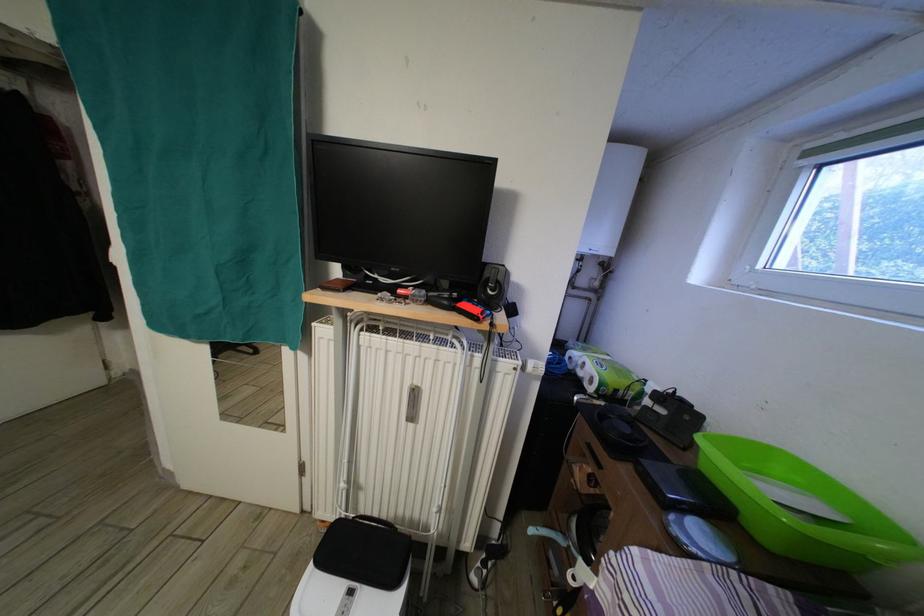
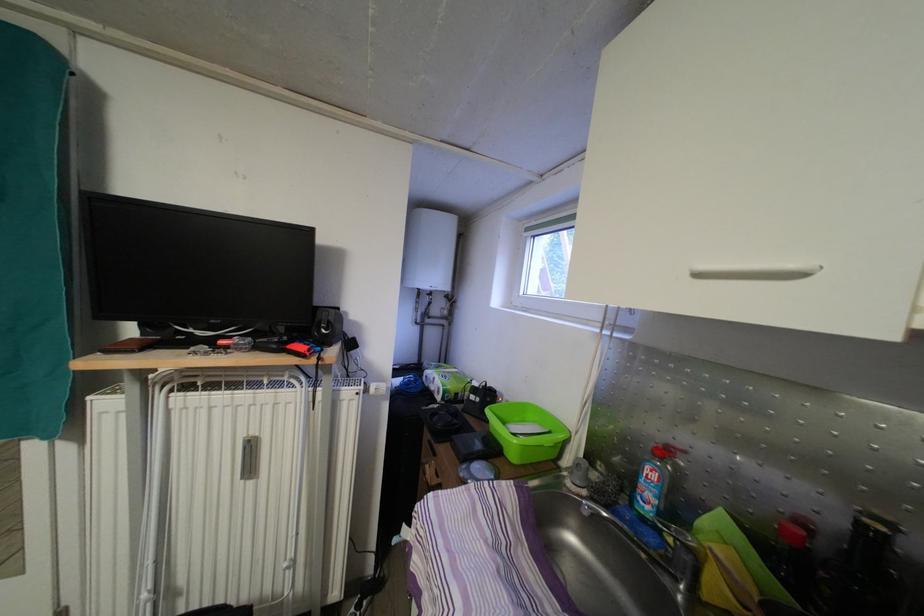
Where in the second image is the point corresponding to the point at 622,387 from the first image?

(460, 394)